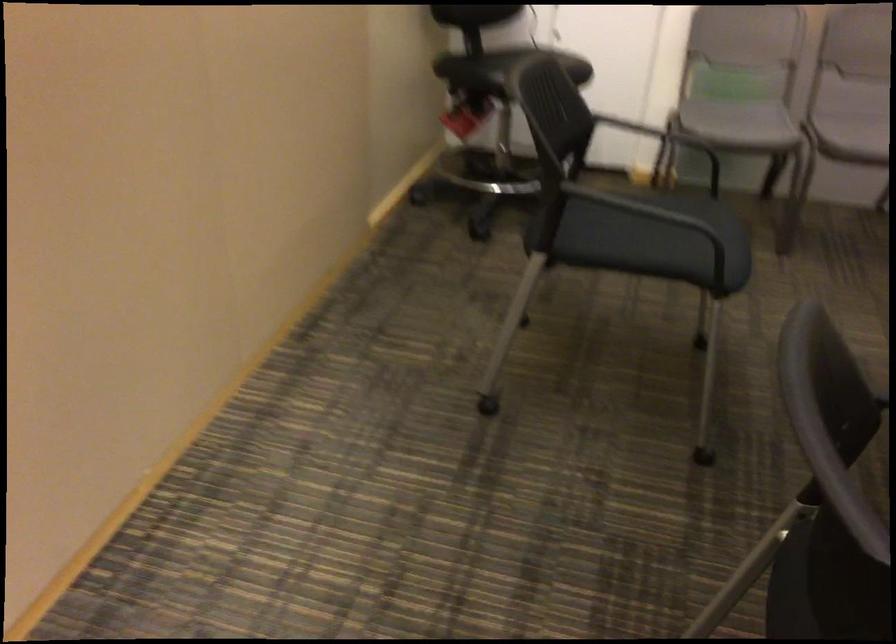
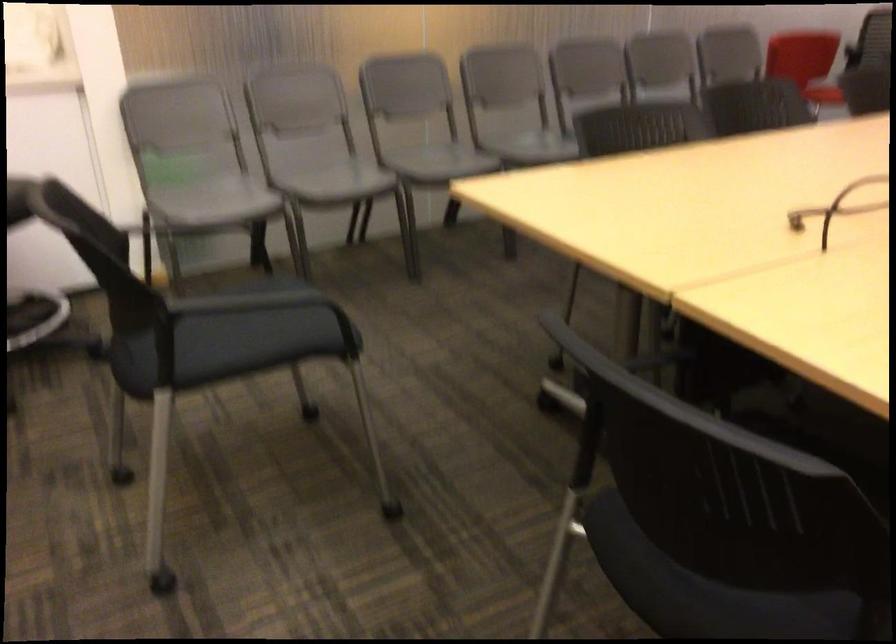
Find the pixel in the second image that matches (x=643, y=230) in the first image.

(235, 336)